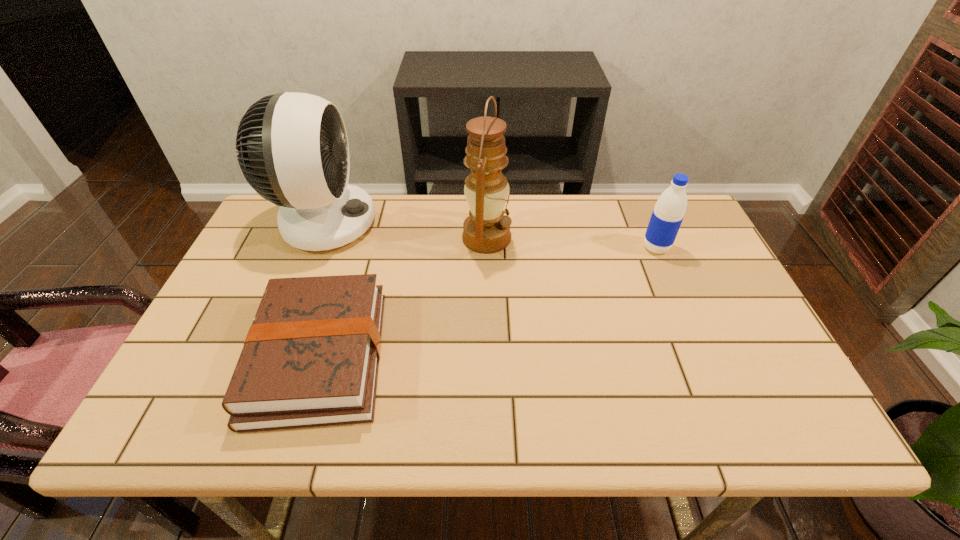
Identify the location of oil lamp at the far edge. The image size is (960, 540). (486, 230).

This screenshot has height=540, width=960. I want to click on fan present at the far edge, so click(293, 149).

I want to click on water bottle that is at the far edge, so click(x=668, y=213).

The image size is (960, 540). In order to click on object located at the near edge in this screenshot , I will do `click(310, 358)`.

You are a GUI agent. You are given a task and a screenshot of the screen. Output one action in this format:
    pyautogui.click(x=<x>, y=<y>)
    Task: Click on the fan located in the left edge section of the desktop
    The height and width of the screenshot is (540, 960).
    Given the screenshot: What is the action you would take?
    (x=293, y=149)

The width and height of the screenshot is (960, 540). What are the coordinates of `hardback book that is at the left edge` in the screenshot? It's located at (310, 358).

Image resolution: width=960 pixels, height=540 pixels. I want to click on object that is positioned at the right edge, so click(668, 213).

Where is `object that is at the far left corner`? The image size is (960, 540). object that is at the far left corner is located at coordinates (293, 149).

Find the location of a particular element. object at the near left corner is located at coordinates (310, 358).

Where is `object present at the far right corner`? object present at the far right corner is located at coordinates (668, 213).